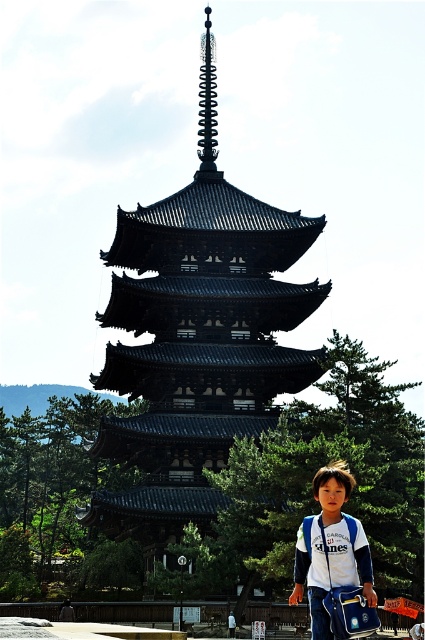
You are a photographer trying to capture the black wooden pagoda at center and the white fabric backpack at lower center in a single frame. Which object should you focus on first to ensure both are in the frame without moving the camera?

You should focus on the black wooden pagoda at center first since it is larger and more central, ensuring both it and the smaller white fabric backpack at lower center are captured in the frame.

You are a tourist standing at the base of the pagoda and want to take a photo of the spire at the top. There are two points marked on the ground in front of you at coordinates point (136, 531) and point (314, 573). Which point should you stand at to ensure the spire is fully visible without any obstruction from the pagoda itself?

You should stand at point (314, 573) because point (136, 531) is behind it, meaning standing there might block the view of the spire.